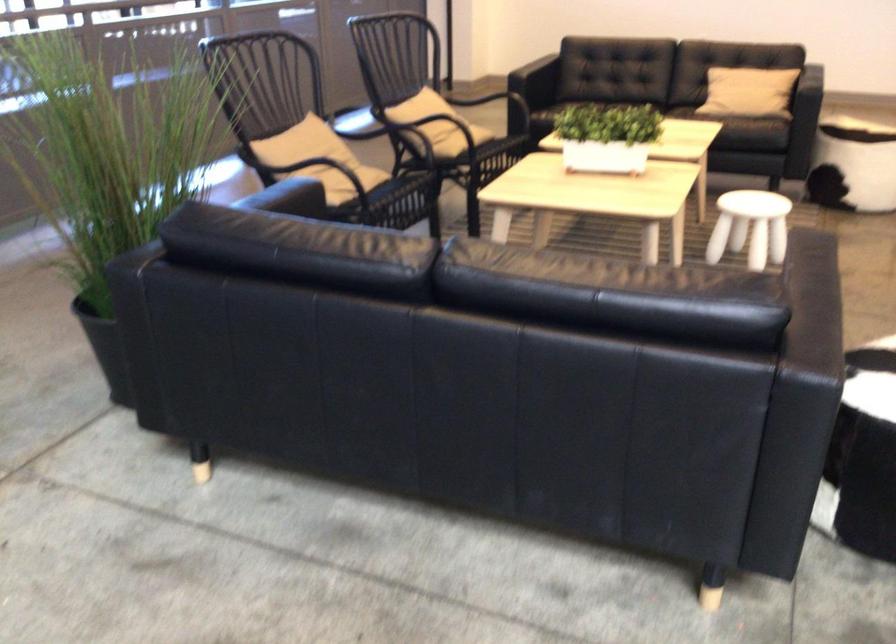
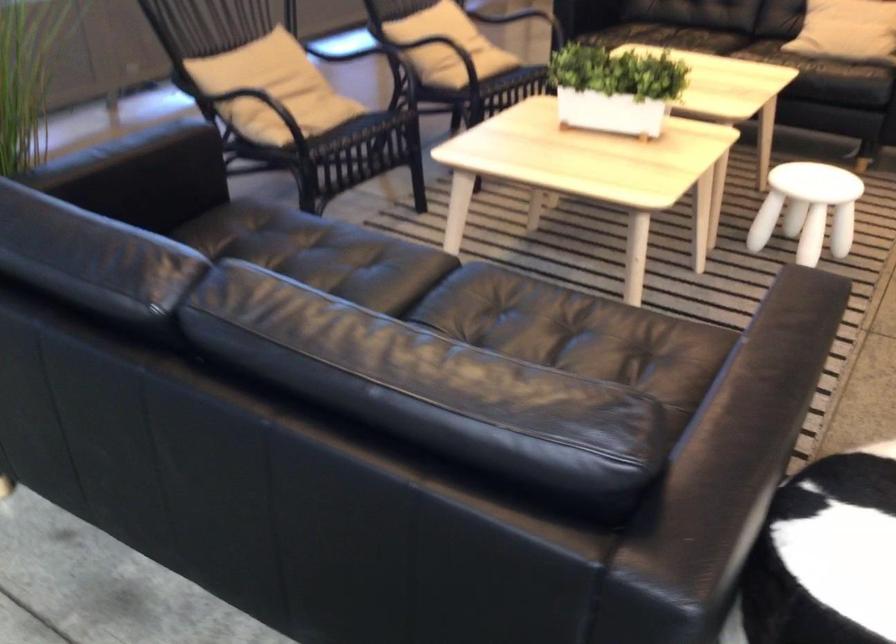
The point at (x=760, y=222) is marked in the first image. Where is the corresponding point in the second image?

(807, 209)